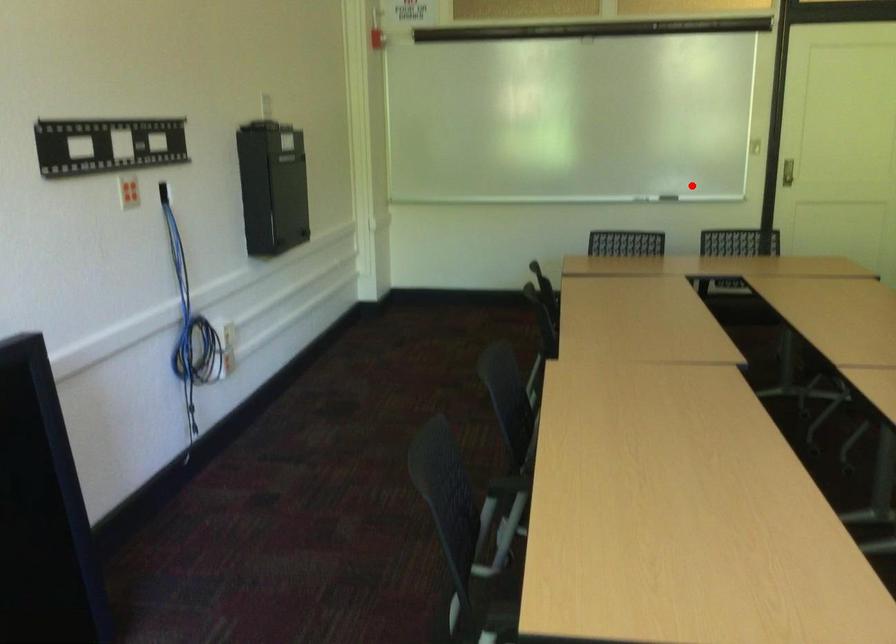
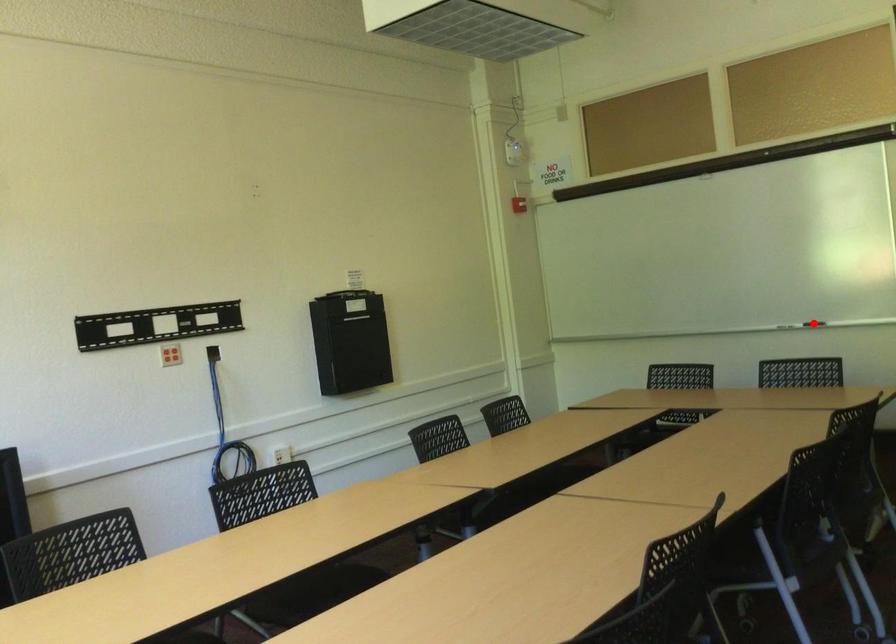
I am providing you with two images of the same scene from different viewpoints. A red point is marked on the first image and another point is marked on the second image. Do the highlighted points in image1 and image2 indicate the same real-world spot?

Yes